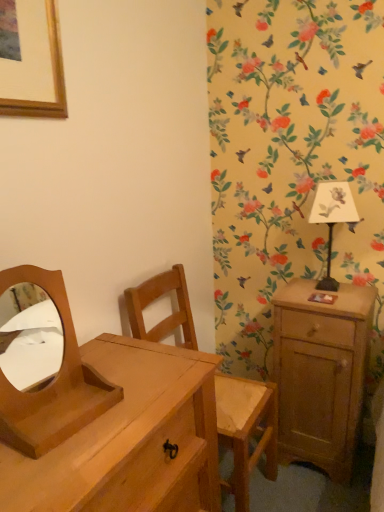
Question: From a real-world perspective, is light brown wood nightstand at right located higher than white paper lampshade at upper right?

Choices:
 (A) no
 (B) yes

Answer: (A)

Question: Does light brown wood nightstand at right have a lesser height compared to white paper lampshade at upper right?

Choices:
 (A) yes
 (B) no

Answer: (B)

Question: Can white paper lampshade at upper right be found inside light brown wood nightstand at right?

Choices:
 (A) yes
 (B) no

Answer: (B)

Question: Is light brown wood nightstand at right next to white paper lampshade at upper right and touching it?

Choices:
 (A) yes
 (B) no

Answer: (B)

Question: Is light brown wood nightstand at right located outside white paper lampshade at upper right?

Choices:
 (A) no
 (B) yes

Answer: (B)

Question: Choose the correct answer: Is white paper lampshade at upper right inside wooden swivel chair at center or outside it?

Choices:
 (A) outside
 (B) inside

Answer: (A)

Question: Is point (316, 286) closer or farther from the camera than point (150, 301)?

Choices:
 (A) closer
 (B) farther

Answer: (B)

Question: Considering the relative positions of white paper lampshade at upper right and wooden swivel chair at center in the image provided, is white paper lampshade at upper right to the left or to the right of wooden swivel chair at center?

Choices:
 (A) left
 (B) right

Answer: (B)

Question: Considering their positions, is white paper lampshade at upper right located in front of or behind wooden swivel chair at center?

Choices:
 (A) front
 (B) behind

Answer: (B)

Question: Is wooden swivel chair at center spatially inside light brown wooden chest of drawers at lower left, or outside of it?

Choices:
 (A) inside
 (B) outside

Answer: (B)

Question: From the image's perspective, is wooden swivel chair at center positioned above or below light brown wooden chest of drawers at lower left?

Choices:
 (A) above
 (B) below

Answer: (A)

Question: Is point (243, 433) positioned closer to the camera than point (185, 448)?

Choices:
 (A) farther
 (B) closer

Answer: (A)

Question: Is wooden swivel chair at center wider or thinner than light brown wooden chest of drawers at lower left?

Choices:
 (A) wide
 (B) thin

Answer: (B)

Question: Does point (273, 470) appear closer or farther from the camera than point (13, 430)?

Choices:
 (A) closer
 (B) farther

Answer: (B)

Question: In terms of width, does wooden swivel chair at center look wider or thinner when compared to wooden/matte mirror at left?

Choices:
 (A) thin
 (B) wide

Answer: (B)